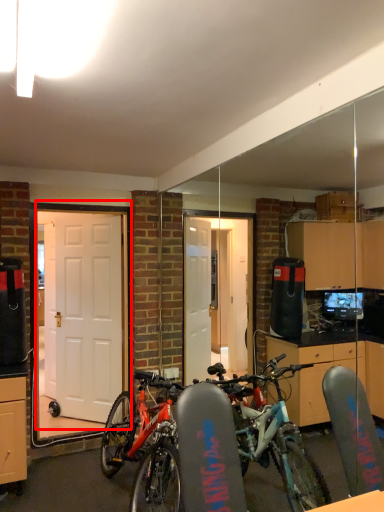
Question: From the image's perspective, where is door (annotated by the red box) located relative to door?

Choices:
 (A) above
 (B) below

Answer: (A)